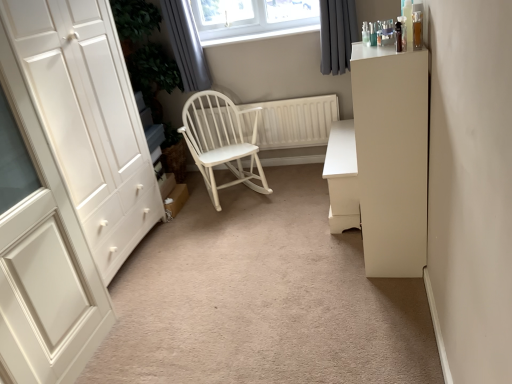
Question: From their relative heights in the image, would you say white wood rocking chair at center is taller or shorter than dark grey fabric curtain at upper right, the second curtain when ordered from left to right?

Choices:
 (A) short
 (B) tall

Answer: (B)

Question: Considering their positions, is white wood rocking chair at center located in front of or behind dark grey fabric curtain at upper right, the second curtain when ordered from left to right?

Choices:
 (A) behind
 (B) front

Answer: (B)

Question: Considering the real-world distances, which object is farthest from the white wood wardrobe at left?

Choices:
 (A) white wood rocking chair at center
 (B) white matte chest of drawers at center
 (C) gray fabric curtain at upper center, which is counted as the second curtain, starting from the right
 (D) white painted wood wardrobe at left
 (E) white matte cabinet at right

Answer: (C)

Question: Which object is the farthest from the white matte chest of drawers at center?

Choices:
 (A) white wood rocking chair at center
 (B) gray fabric curtain at upper center, which appears as the first curtain when viewed from the left
 (C) white matte cabinet at right
 (D) dark grey fabric curtain at upper right, the 1th curtain in the right-to-left sequence
 (E) white painted wood wardrobe at left

Answer: (E)